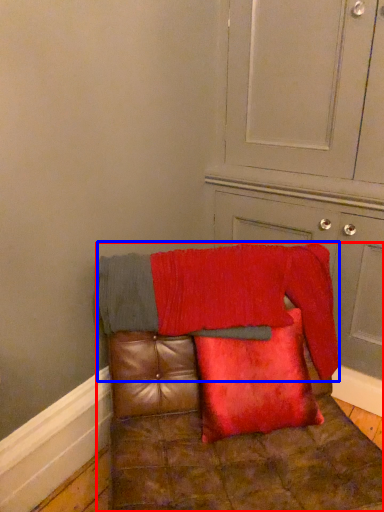
Question: Which point is closer to the camera, furniture (highlighted by a red box) or blanket (highlighted by a blue box)?

Choices:
 (A) furniture
 (B) blanket

Answer: (A)